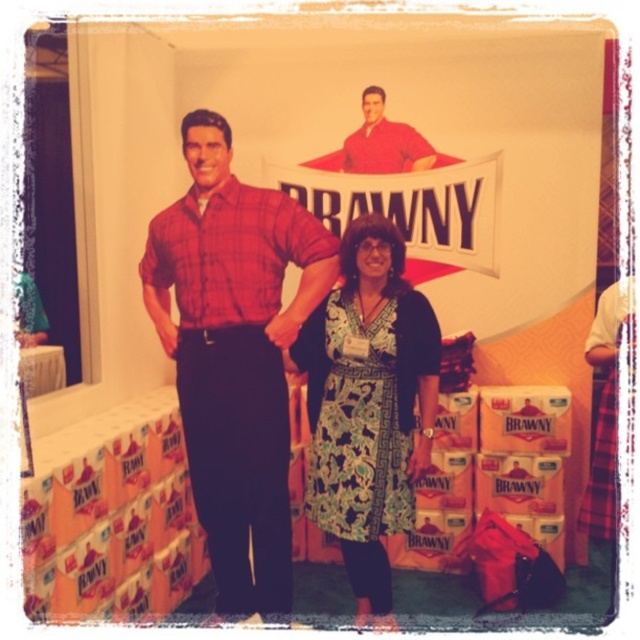
Can you confirm if printed fabric dress at center is thinner than matte red shirt at center?

Incorrect, printed fabric dress at center's width is not less than matte red shirt at center's.

Does printed fabric dress at center have a greater height compared to matte red shirt at center?

Correct, printed fabric dress at center is much taller as matte red shirt at center.

Identify the location of printed fabric dress at center. This screenshot has width=640, height=640. (368, 404).

Image resolution: width=640 pixels, height=640 pixels. In order to click on printed fabric dress at center in this screenshot , I will do `click(368, 404)`.

Does plaid shirt at center have a lesser width compared to printed fabric dress at center?

No.

Does point (232, 220) come farther from viewer compared to point (369, 228)?

That is False.

Image resolution: width=640 pixels, height=640 pixels. In order to click on plaid shirt at center in this screenshot , I will do `click(234, 355)`.

Can you confirm if plaid shirt at center is bigger than matte red shirt at center?

Yes.

Which is in front, point (285, 458) or point (369, 120)?

Positioned in front is point (285, 458).

Describe the element at coordinates (234, 355) in the screenshot. The image size is (640, 640). I see `plaid shirt at center` at that location.

Where is `plaid shirt at center`? The height and width of the screenshot is (640, 640). plaid shirt at center is located at coordinates (234, 355).